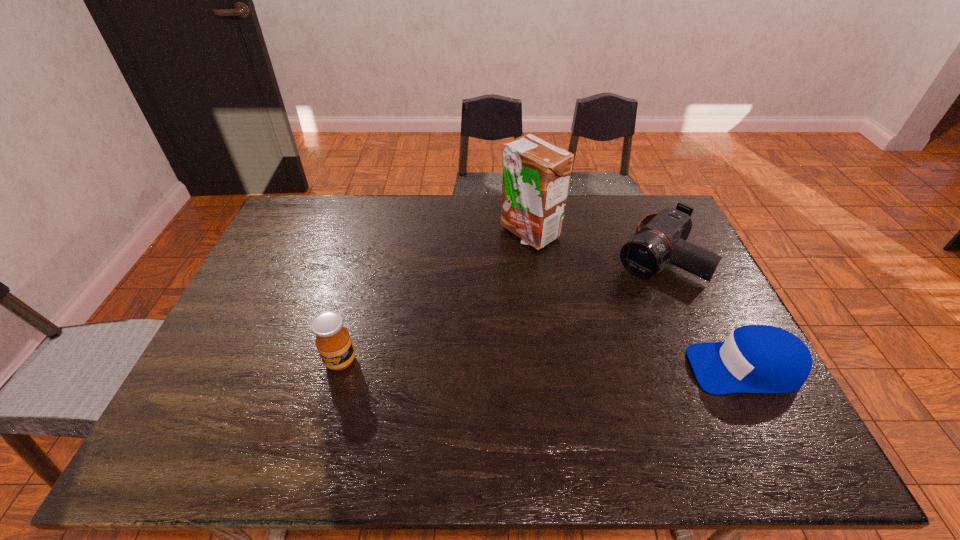
Locate an element on the screen. The image size is (960, 540). the second tallest object is located at coordinates (333, 341).

This screenshot has width=960, height=540. What are the coordinates of `honey` in the screenshot? It's located at (333, 341).

You are a GUI agent. You are given a task and a screenshot of the screen. Output one action in this format:
    pyautogui.click(x=<x>, y=<y>)
    Task: Click on the baseball cap
    The width and height of the screenshot is (960, 540).
    Given the screenshot: What is the action you would take?
    (x=755, y=358)

Where is `the tallest object`? the tallest object is located at coordinates (536, 174).

The height and width of the screenshot is (540, 960). In order to click on carton in this screenshot , I will do `click(536, 174)`.

Locate an element on the screen. The width and height of the screenshot is (960, 540). camcorder is located at coordinates (659, 236).

You are a GUI agent. You are given a task and a screenshot of the screen. Output one action in this format:
    pyautogui.click(x=<x>, y=<y>)
    Task: Click on the vacant point located 0.080m on the front-facing side of the second tallest object
    The height and width of the screenshot is (540, 960).
    Given the screenshot: What is the action you would take?
    pyautogui.click(x=329, y=403)

Image resolution: width=960 pixels, height=540 pixels. In order to click on vacant region located on the front-facing side of the baseball cap in this screenshot , I will do `click(560, 368)`.

Image resolution: width=960 pixels, height=540 pixels. I want to click on vacant region located 0.380m on the front-facing side of the baseball cap, so click(540, 368).

I want to click on free space located 0.340m on the front-facing side of the baseball cap, so click(556, 368).